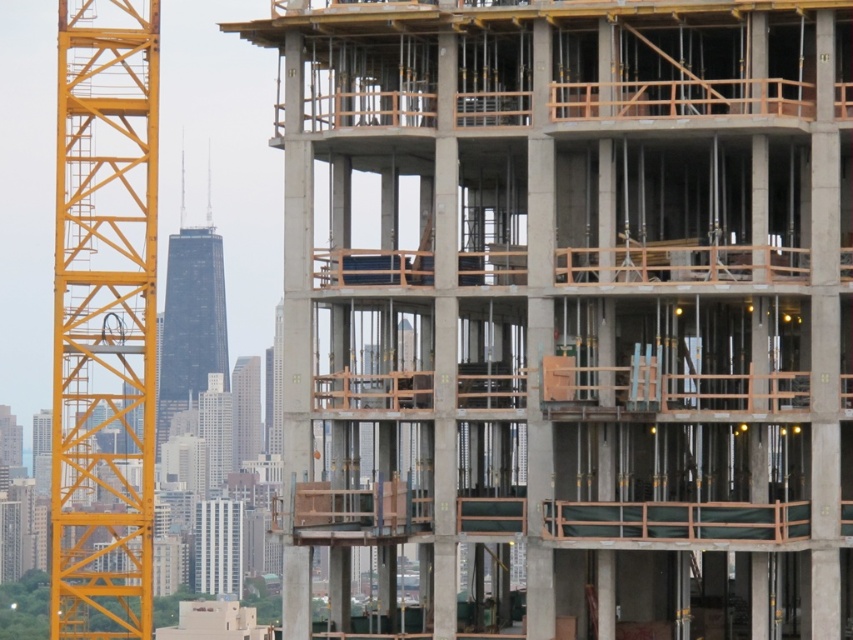
Does yellow metallic crane at left appear over concrete/wooden construction at center?

Correct, yellow metallic crane at left is located above concrete/wooden construction at center.

Does yellow metallic crane at left appear on the left side of concrete/wooden construction at center?

Yes, yellow metallic crane at left is to the left of concrete/wooden construction at center.

Measure the distance between point (68,38) and camera.

Point (68,38) is 1770.68 feet from camera.

This screenshot has height=640, width=853. What are the coordinates of `yellow metallic crane at left` in the screenshot? It's located at (103, 321).

Is yellow metallic crane at left behind concrete building at center?

No.

Based on the photo, does yellow metallic crane at left have a smaller size compared to concrete building at center?

Incorrect, yellow metallic crane at left is not smaller in size than concrete building at center.

Locate an element on the screen. This screenshot has width=853, height=640. yellow metallic crane at left is located at coordinates (103, 321).

You are a GUI agent. You are given a task and a screenshot of the screen. Output one action in this format:
    pyautogui.click(x=<x>, y=<y>)
    Task: Click on the yellow metallic crane at left
    This screenshot has width=853, height=640.
    Given the screenshot: What is the action you would take?
    pyautogui.click(x=103, y=321)

Does point (111, 449) come closer to viewer compared to point (196, 250)?

No, (111, 449) is further to viewer.

Between yellow metallic crane at left and dark glass skyscraper at center, which one appears on the left side from the viewer's perspective?

yellow metallic crane at left

Who is more distant from viewer, (90, 195) or (190, 323)?

Point (190, 323)

The image size is (853, 640). In order to click on yellow metallic crane at left in this screenshot , I will do `click(103, 321)`.